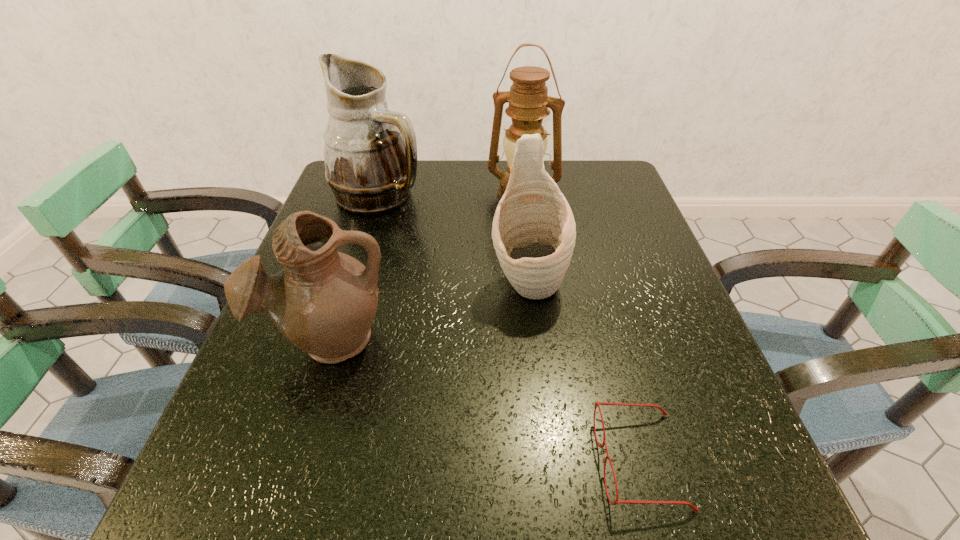
Find the location of a particular element. This screenshot has height=540, width=960. free location located on the face of the nearest object is located at coordinates (368, 461).

I want to click on free region located 0.380m on the face of the nearest object, so click(x=348, y=461).

At what (x,y) coordinates should I click in order to perform the action: click on blank space located on the face of the nearest object. Please return your answer as a coordinate pair (x, y). The image size is (960, 540). Looking at the image, I should click on (441, 461).

Where is `oil lamp situated at the far edge`? oil lamp situated at the far edge is located at coordinates (528, 99).

Identify the location of pitcher that is at the far edge. The image size is (960, 540). (370, 153).

This screenshot has height=540, width=960. I want to click on object positioned at the near edge, so click(617, 501).

This screenshot has height=540, width=960. I want to click on object situated at the right edge, so click(617, 501).

The width and height of the screenshot is (960, 540). In order to click on object located at the far left corner in this screenshot , I will do `click(370, 153)`.

You are a GUI agent. You are given a task and a screenshot of the screen. Output one action in this format:
    pyautogui.click(x=<x>, y=<y>)
    Task: Click on the object that is positioned at the near right corner
    
    Given the screenshot: What is the action you would take?
    pyautogui.click(x=617, y=501)

Where is `vacant space at the left edge`? The image size is (960, 540). vacant space at the left edge is located at coordinates (355, 230).